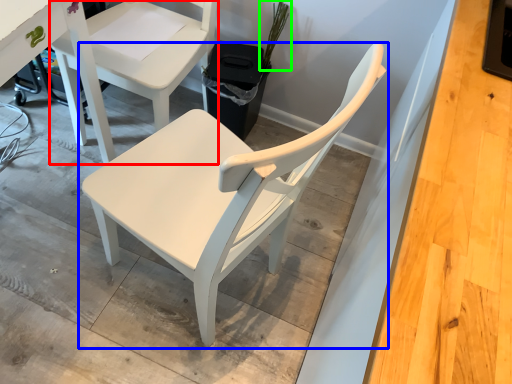
Question: Which object is the farthest from chair (highlighted by a red box)? Choose among these: chair (highlighted by a blue box) or plant (highlighted by a green box).

Choices:
 (A) chair
 (B) plant

Answer: (A)